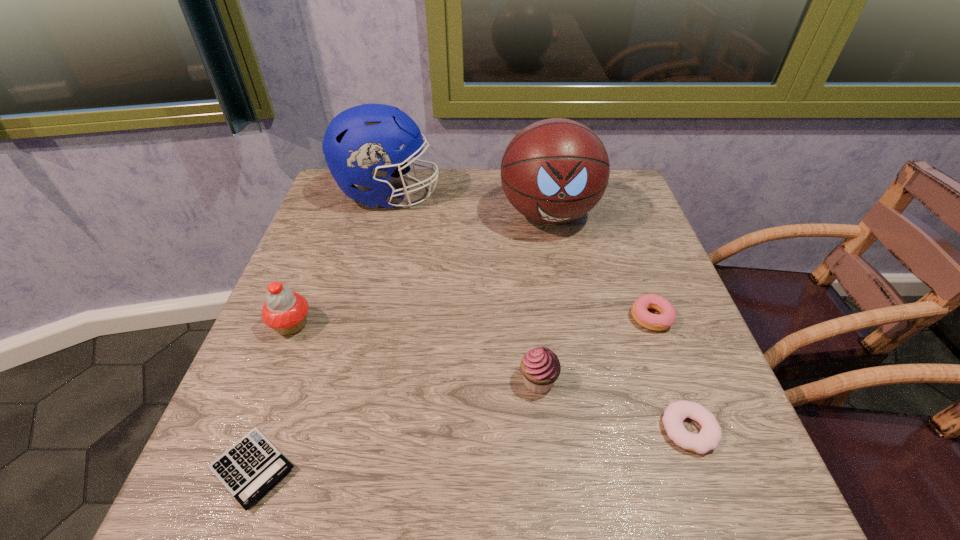
This screenshot has width=960, height=540. I want to click on blank space that satisfies the following two spatial constraints: 1. on the back side of the second shortest object; 2. on the front-facing side of the football helmet, so click(x=604, y=194).